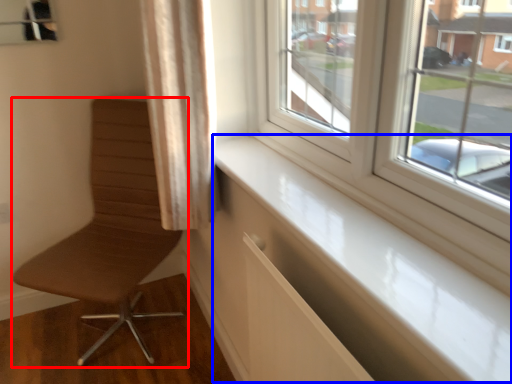
Question: Among these objects, which one is farthest to the camera, chair (highlighted by a red box) or window sill (highlighted by a blue box)?

Choices:
 (A) chair
 (B) window sill

Answer: (A)